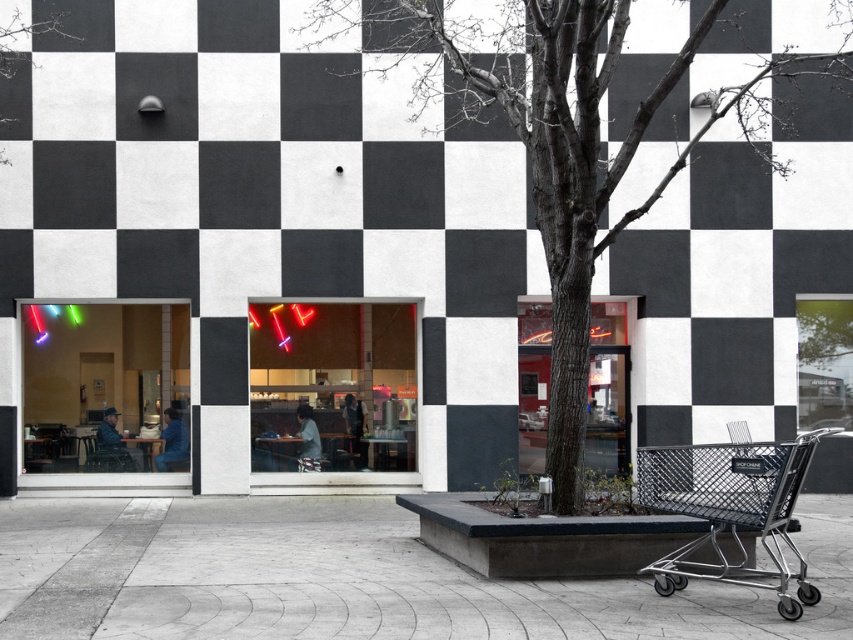
You are a delivery person trying to park your 2.5 meter wide delivery van between the concrete at center and the dark brown bark tree at center. Based on the scene, can you safely park your van there without hitting either object?

The concrete at center is 4.17 meters away from the dark brown bark tree at center. Since your van is 2.5 meters wide, there is enough space between them to park safely without hitting either object.

You are a delivery person trying to unload a package that requires placing it on the ground. You have two options in the scene described. Which surface is shorter between the concrete at center and the dark brown bark tree at center?

The concrete at center is not as tall as the dark brown bark tree at center, so the concrete at center is shorter.